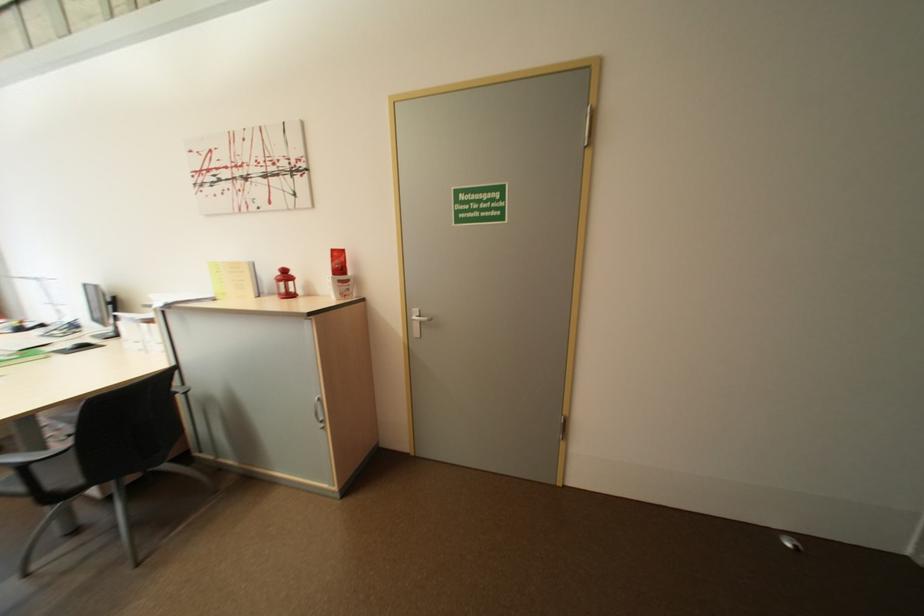
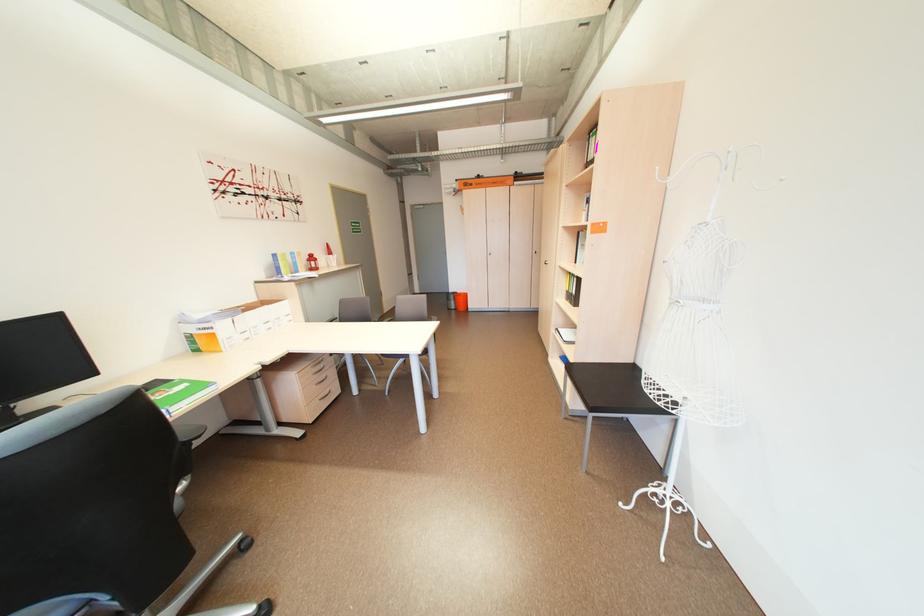
Question: I am providing you with two images of the same scene from different viewpoints. Which of the following objects are not visible in image2?

Choices:
 (A) black chair armrest
 (B) chair sitting surface
 (C) orange-top bottle
 (D) orange bucket

Answer: (B)